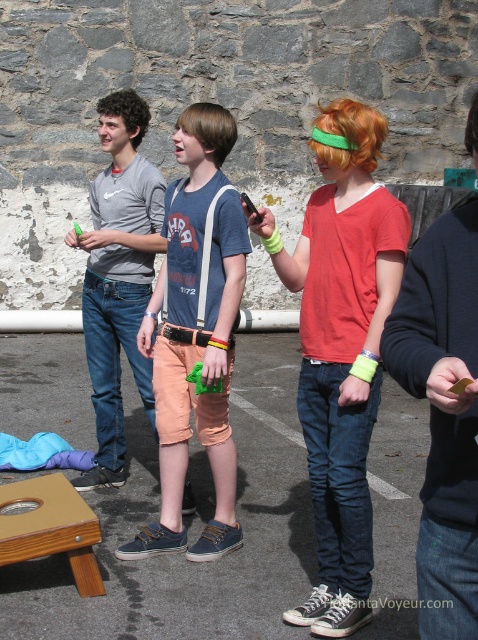
Who is more forward, (454, 417) or (126, 330)?

Point (454, 417) is more forward.

Is point (426, 492) farther from camera compared to point (109, 170)?

That is False.

Is point (421, 616) behind point (144, 104)?

No, it is not.

Identify the location of dark blue sweatshirt at right. This screenshot has width=478, height=640. (443, 412).

From the picture: Does matte red t-shirt at center have a larger size compared to dark blue sweatshirt at right?

Yes, matte red t-shirt at center is bigger than dark blue sweatshirt at right.

From the picture: Does matte red t-shirt at center have a greater height compared to dark blue sweatshirt at right?

Yes.

Which is in front, point (387, 243) or point (454, 244)?

Point (454, 244) is in front.

Find the location of a particular element. Image resolution: width=478 pixels, height=640 pixels. matte red t-shirt at center is located at coordinates (340, 348).

From the picture: Is dark blue sweatshirt at right wider than wooden stool at lower left?

Incorrect, dark blue sweatshirt at right's width does not surpass wooden stool at lower left's.

Who is higher up, dark blue sweatshirt at right or wooden stool at lower left?

dark blue sweatshirt at right is above.

Who is more distant from viewer, (476, 419) or (58, 509)?

The point (58, 509) is more distant.

At what (x,y) coordinates should I click in order to perform the action: click on dark blue sweatshirt at right. Please return your answer as a coordinate pair (x, y). Looking at the image, I should click on (443, 412).